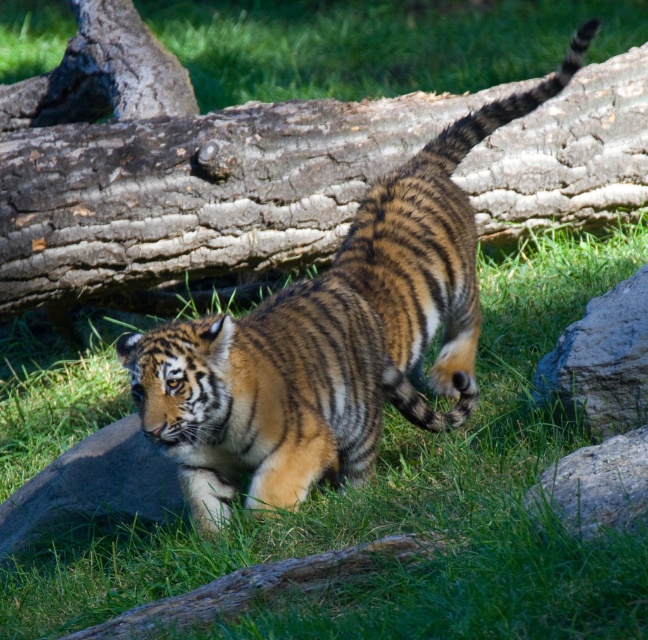
Does green grass at center appear on the left side of striped fur tiger at center?

Indeed, green grass at center is positioned on the left side of striped fur tiger at center.

At what (x,y) coordinates should I click in order to perform the action: click on green grass at center. Please return your answer as a coordinate pair (x, y). This screenshot has height=640, width=648. Looking at the image, I should click on (400, 504).

Does point (91, 621) come behind point (386, 176)?

That is False.

Where is `green grass at center`? green grass at center is located at coordinates (x=400, y=504).

Can you confirm if gray smooth rock at lower left is positioned to the right of gray rough rock at right?

A: No, gray smooth rock at lower left is not to the right of gray rough rock at right.

Which is below, gray smooth rock at lower left or gray rough rock at right?

gray smooth rock at lower left is below.

Is point (106, 481) farther from viewer compared to point (562, 380)?

Yes, point (106, 481) is behind point (562, 380).

The image size is (648, 640). What are the coordinates of `gray smooth rock at lower left` in the screenshot? It's located at (93, 484).

Can you confirm if brown rough bark log at center is bigger than striped fur tiger at center?

No, brown rough bark log at center is not bigger than striped fur tiger at center.

Which is below, brown rough bark log at center or striped fur tiger at center?

striped fur tiger at center is lower down.

Is point (135, 266) in front of point (340, 444)?

No, it is behind (340, 444).

Identify the location of brown rough bark log at center. The width and height of the screenshot is (648, 640). (189, 180).